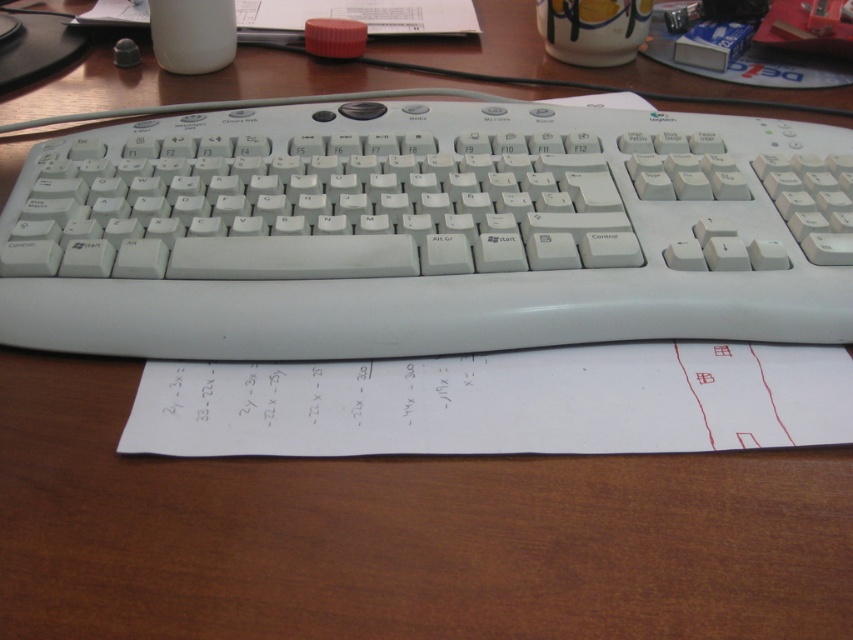
You are a student trying to reach for the white paper at lower center while your hand is currently near the white plastic keyboard at center. Which direction should you move your hand to grab it?

The white plastic keyboard at center is to the left of the white paper at lower center, so you should move your hand to the right to grab the white paper at lower center.

You are trying to place a small sticker on the desk between the white plastic keyboard at center and the white paper at lower center. Considering their heights, which object should you place the sticker closer to in order to ensure it remains visible above the other?

The white plastic keyboard at center is taller than the white paper at lower center. To ensure the sticker remains visible above the other object, place it closer to the white paper at lower center.

You are a student trying to reach for the white paper at lower center without moving the white plastic keyboard at center. Can you easily access it?

The white plastic keyboard at center is further to the viewer than the white paper at lower center, so the paper is closer to you. Since the keyboard is in front of the paper, you might have to move it to access the paper easily.